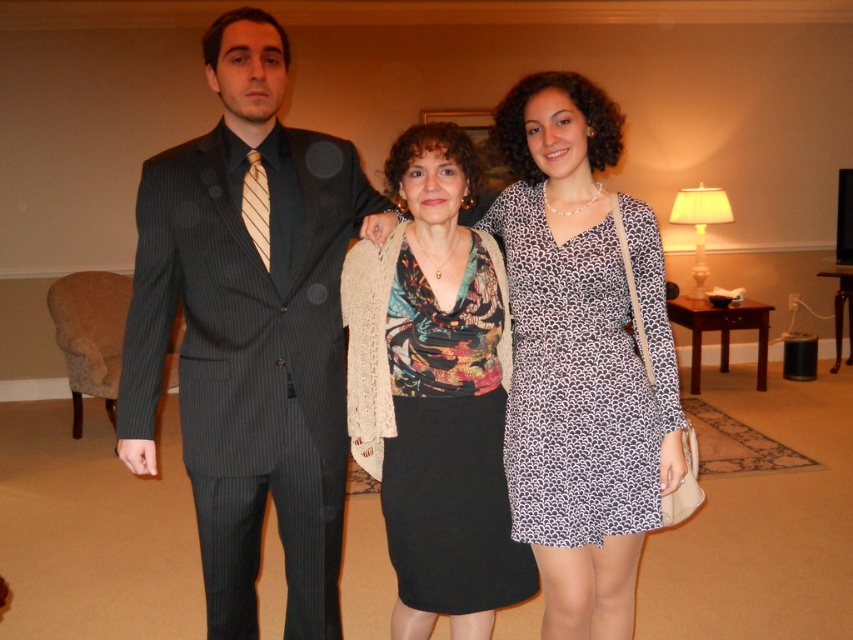
Can you confirm if dark gray pinstripe suit at center is taller than leopard print dress at center?

Correct, dark gray pinstripe suit at center is much taller as leopard print dress at center.

Does point (213, 400) lie in front of point (509, 237)?

That is True.

What do you see at coordinates (250, 330) in the screenshot?
I see `dark gray pinstripe suit at center` at bounding box center [250, 330].

Where is `dark gray pinstripe suit at center`? The width and height of the screenshot is (853, 640). dark gray pinstripe suit at center is located at coordinates (250, 330).

Which of these two, matte black suit at left or leopard print dress at center, stands taller?

matte black suit at left

Which is more to the right, matte black suit at left or leopard print dress at center?

From the viewer's perspective, leopard print dress at center appears more on the right side.

Is point (582, 584) positioned behind point (648, 456)?

No, it is not.

Identify the location of matte black suit at left. (581, 360).

Looking at this image, is matte black suit at left above black textured skirt at center?

Yes, matte black suit at left is above black textured skirt at center.

Does matte black suit at left have a lesser width compared to black textured skirt at center?

No, matte black suit at left is not thinner than black textured skirt at center.

Which is behind, point (553, 492) or point (463, 193)?

The point (463, 193) is more distant.

Find the location of a particular element. matte black suit at left is located at coordinates (581, 360).